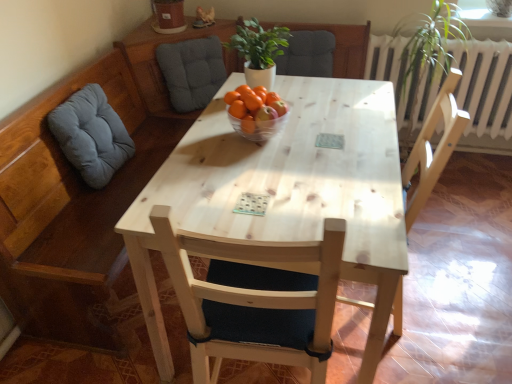
Question: From a real-world perspective, is light wood chair at right, acting as the first chair starting from the right, above or below gray fabric cushion at upper left, positioned as the 1th swivel chair in back-to-front order?

Choices:
 (A) above
 (B) below

Answer: (B)

Question: Is light wood chair at right, the 2th chair positioned from the left, taller or shorter than gray fabric cushion at upper left, the 2th swivel chair positioned from the left?

Choices:
 (A) short
 (B) tall

Answer: (B)

Question: Which is nearer to the white matte plant at center?

Choices:
 (A) gray fabric cushion at left, the second swivel chair positioned from the right
 (B) matte gray cushioned armchair at upper center
 (C) light wood chair at right, acting as the first chair starting from the right
 (D) gray fabric cushion at upper left, the 2th swivel chair positioned from the left
 (E) transparent glass bowl at center

Answer: (E)

Question: Based on their relative distances, which object is nearer to the gray fabric cushion at left, which is the 1th swivel chair in left-to-right order?

Choices:
 (A) gray fabric cushion at upper left, positioned as the 1th swivel chair in back-to-front order
 (B) light wood chair at right, the 2th chair positioned from the left
 (C) white matte plant at center
 (D) light wood chair at center, the second chair viewed from the right
 (E) transparent glass bowl at center

Answer: (E)